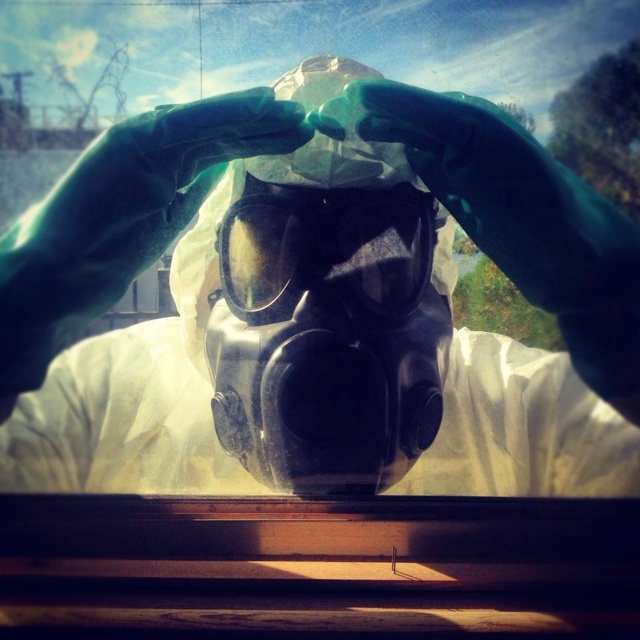
Question: Which object is farther from the camera taking this photo?

Choices:
 (A) black matte gas mask at center
 (B) transparent plastic goggles at center

Answer: (B)

Question: Which point is farther to the camera?

Choices:
 (A) transparent plastic goggles at center
 (B) black matte gas mask at center

Answer: (A)

Question: Where is black matte gas mask at center located in relation to transparent plastic goggles at center in the image?

Choices:
 (A) above
 (B) below

Answer: (B)

Question: Where is black matte gas mask at center located in relation to transparent plastic goggles at center in the image?

Choices:
 (A) below
 (B) above

Answer: (A)

Question: Which point is closer to the camera taking this photo?

Choices:
 (A) (333, 228)
 (B) (348, 248)

Answer: (A)

Question: Does black matte gas mask at center have a larger size compared to transparent plastic goggles at center?

Choices:
 (A) no
 (B) yes

Answer: (B)